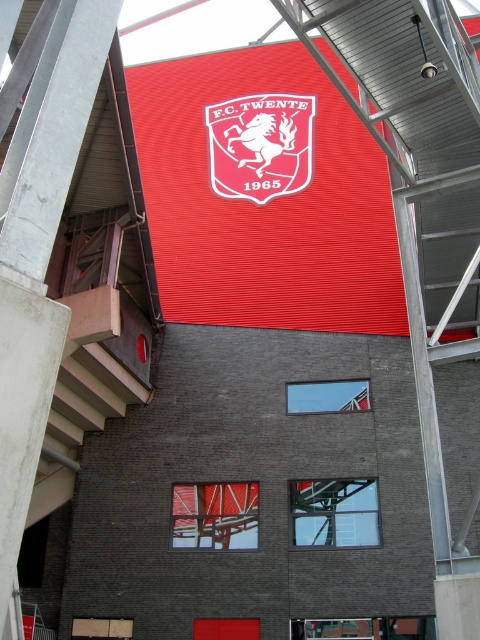
Which is in front, point (280, 182) or point (368, 388)?

Point (368, 388) is in front.

This screenshot has width=480, height=640. I want to click on matte red shield at center, so click(x=261, y=145).

Identify the location of matte red shield at center. (261, 145).